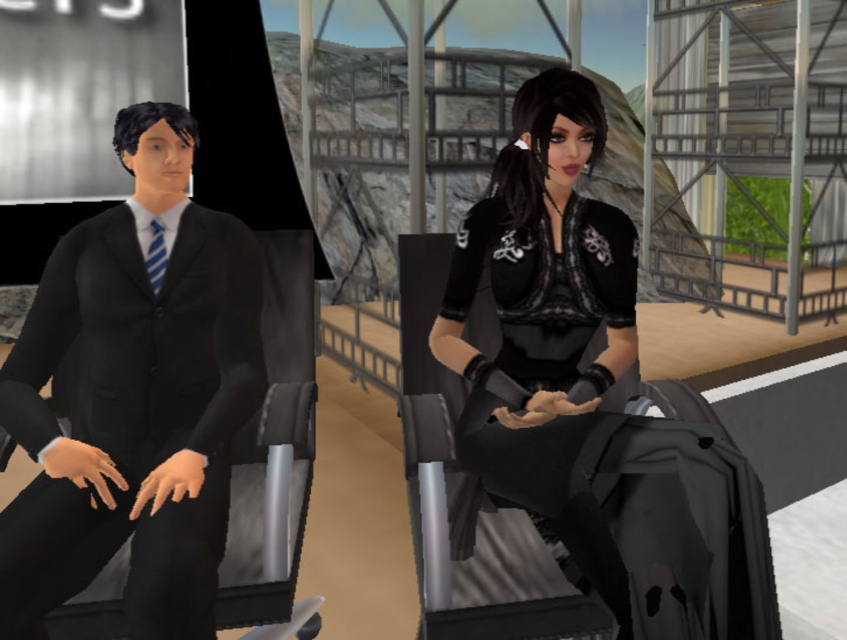
Question: Is matte black suit at left bigger than black lace dress at center?

Choices:
 (A) no
 (B) yes

Answer: (B)

Question: Among these points, which one is farthest from the camera?

Choices:
 (A) (145, 364)
 (B) (502, 282)

Answer: (A)

Question: Does matte black suit at left appear over black lace dress at center?

Choices:
 (A) no
 (B) yes

Answer: (B)

Question: Is matte black suit at left positioned behind black lace dress at center?

Choices:
 (A) no
 (B) yes

Answer: (B)